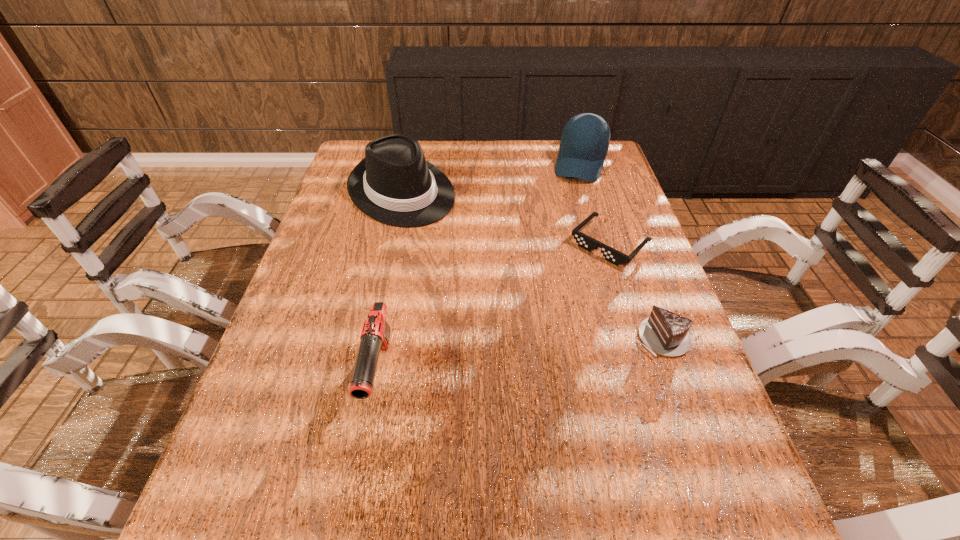
Image resolution: width=960 pixels, height=540 pixels. In order to click on gun in this screenshot , I will do `click(375, 336)`.

Find the location of a particular element. Image resolution: width=960 pixels, height=540 pixels. chocolate cake is located at coordinates (666, 333).

At what (x,y) coordinates should I click in order to perform the action: click on baseball cap. Please return your answer as a coordinate pair (x, y). Looking at the image, I should click on (585, 139).

Find the location of a particular element. The image size is (960, 540). the shortest object is located at coordinates (584, 241).

Identify the location of fedora. The height and width of the screenshot is (540, 960). (394, 184).

At what (x,y) coordinates should I click in order to perform the action: click on vacant space situated at the aiming end of the gun. Please return your answer as a coordinate pair (x, y). Looking at the image, I should click on (362, 468).

Locate an element on the screen. The height and width of the screenshot is (540, 960). free space located on the back of the second shortest object is located at coordinates (615, 214).

What are the coordinates of `free space located on the front-facing side of the baseball cap` in the screenshot? It's located at (567, 219).

Where is `vacant space located 0.100m on the front-facing side of the baseball cap`? vacant space located 0.100m on the front-facing side of the baseball cap is located at coordinates (x=572, y=201).

Find the location of a particular element. vacant space located 0.080m on the front-facing side of the baseball cap is located at coordinates (574, 198).